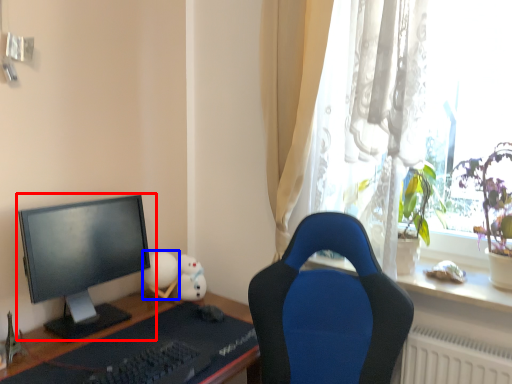
Question: Which object is closer to the camera taking this photo, computer monitor (highlighted by a red box) or toy (highlighted by a blue box)?

Choices:
 (A) computer monitor
 (B) toy

Answer: (A)